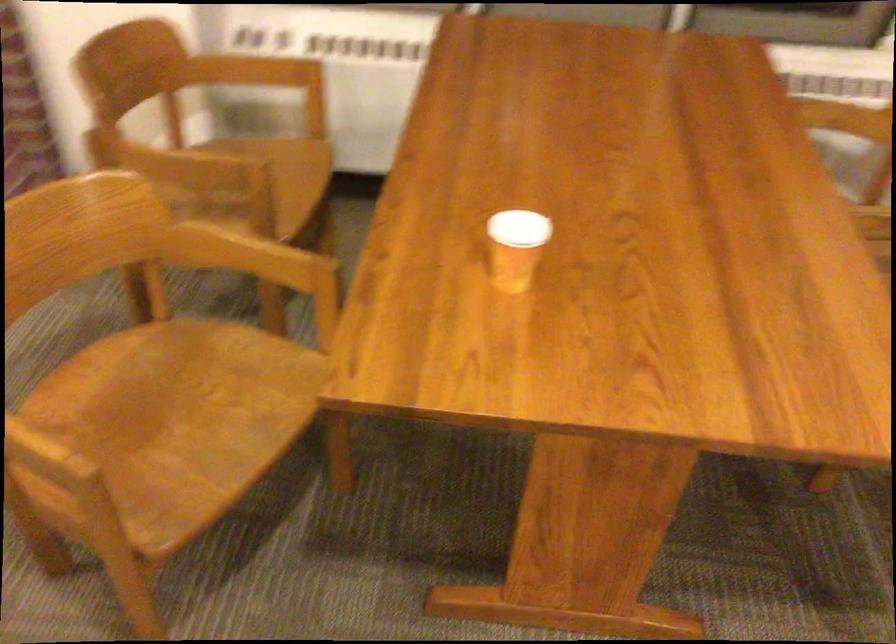
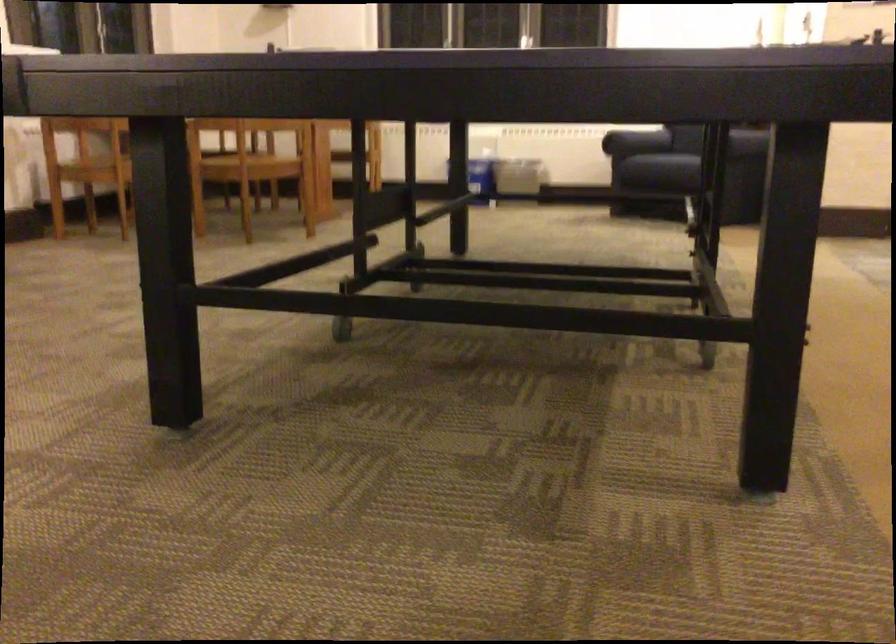
Question: I am providing you with two images of the same scene from different viewpoints. After the viewpoint changes to image2, which objects are now occluded?

Choices:
 (A) chair sitting surface
 (B) sofa sitting surface
 (C) orange plastic box
 (D) sofa armrest

Answer: (A)